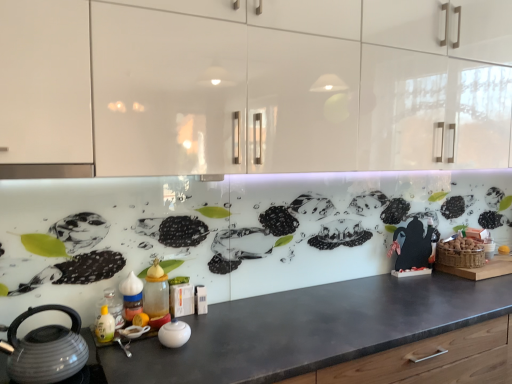
Question: From the image's perspective, is translucent plastic spice jar at center, the 2th bottle when ordered from right to left, located above or below translucent plastic bottle at lower left, the third bottle in the right-to-left sequence?

Choices:
 (A) below
 (B) above

Answer: (A)

Question: In terms of height, does translucent plastic spice jar at center, the 2th bottle when ordered from right to left, look taller or shorter compared to translucent plastic bottle at lower left, which is counted as the first bottle, starting from the left?

Choices:
 (A) short
 (B) tall

Answer: (A)

Question: Which object is positioned closest to the translucent plastic spice jar at center, the 2th bottle positioned from the left?

Choices:
 (A) translucent glass bottle at center, which is counted as the first bottle, starting from the right
 (B) white glossy bowl at center
 (C) translucent plastic bottle at lower left, which is counted as the first bottle, starting from the left
 (D) matte black countertop at center
 (E) matte gray kettle at lower left

Answer: (C)

Question: Which is farther from the translucent plastic bottle at lower left, which is counted as the first bottle, starting from the left?

Choices:
 (A) translucent glass bottle at center, which is counted as the first bottle, starting from the right
 (B) matte gray kettle at lower left
 (C) matte black countertop at center
 (D) white glossy cabinets at upper center
 (E) translucent plastic spice jar at center, the 2th bottle positioned from the left

Answer: (D)